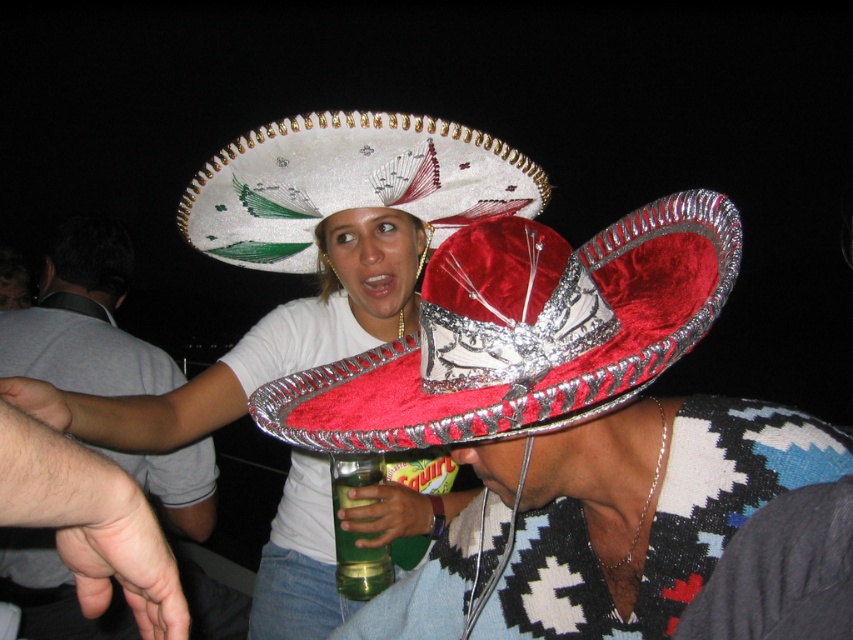
Is white felt sombrero at upper center below smooth gray shirt at upper left?

No, white felt sombrero at upper center is not below smooth gray shirt at upper left.

Does white felt sombrero at upper center have a lesser width compared to smooth gray shirt at upper left?

No, white felt sombrero at upper center is not thinner than smooth gray shirt at upper left.

Is point (614, 344) closer to camera compared to point (114, 241)?

Yes, point (614, 344) is closer to viewer.

You are a GUI agent. You are given a task and a screenshot of the screen. Output one action in this format:
    pyautogui.click(x=<x>, y=<y>)
    Task: Click on the white felt sombrero at upper center
    The image size is (853, 640).
    Given the screenshot: What is the action you would take?
    pyautogui.click(x=561, y=426)

Who is positioned more to the left, white matte sombrero at upper center or green translucent bottle at lower center?

Positioned to the left is white matte sombrero at upper center.

Between white matte sombrero at upper center and green translucent bottle at lower center, which one is positioned lower?

green translucent bottle at lower center is lower down.

Is point (328, 177) less distant than point (346, 556)?

That is False.

Identify the location of white matte sombrero at upper center. The image size is (853, 640). (311, 253).

Does point (556, 396) come farther from viewer compared to point (309, 250)?

No, it is not.

Is white felt sombrero at upper center to the right of white fabric sombrero at upper center from the viewer's perspective?

Correct, you'll find white felt sombrero at upper center to the right of white fabric sombrero at upper center.

Which is in front, point (701, 396) or point (373, 134)?

Positioned in front is point (701, 396).

Find the location of a particular element. white felt sombrero at upper center is located at coordinates (561, 426).